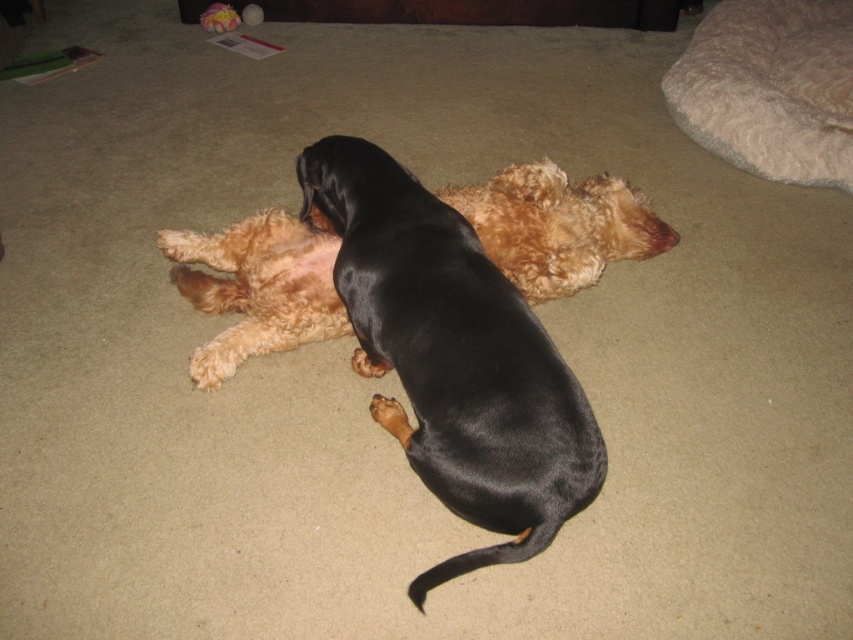
Question: Can you confirm if black shiny dog at center is positioned above shiny black coat at center?

Choices:
 (A) yes
 (B) no

Answer: (B)

Question: Which object is the closest to the shiny black coat at center?

Choices:
 (A) fluffy beige dog bed at upper right
 (B) black shiny dog at center

Answer: (B)

Question: Which object is closer to the camera taking this photo?

Choices:
 (A) black shiny dog at center
 (B) shiny black coat at center
 (C) fluffy beige dog bed at upper right

Answer: (A)

Question: Can you confirm if black shiny dog at center is positioned below fluffy beige dog bed at upper right?

Choices:
 (A) no
 (B) yes

Answer: (B)

Question: Does black shiny dog at center lie in front of shiny black coat at center?

Choices:
 (A) no
 (B) yes

Answer: (B)

Question: Which object is the closest to the fluffy beige dog bed at upper right?

Choices:
 (A) shiny black coat at center
 (B) black shiny dog at center

Answer: (B)